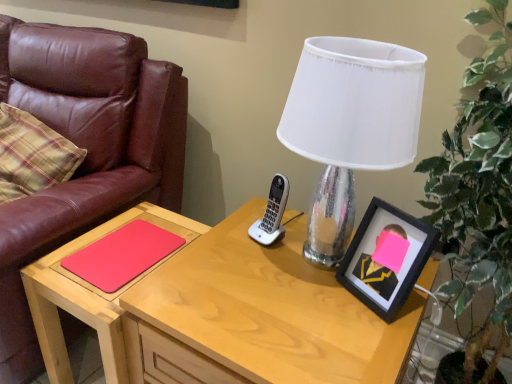
You are a GUI agent. You are given a task and a screenshot of the screen. Output one action in this format:
    pyautogui.click(x=<x>, y=<y>)
    Task: Click on the free region on the left part of clear glass lamp at center
    
    Given the screenshot: What is the action you would take?
    pyautogui.click(x=219, y=266)